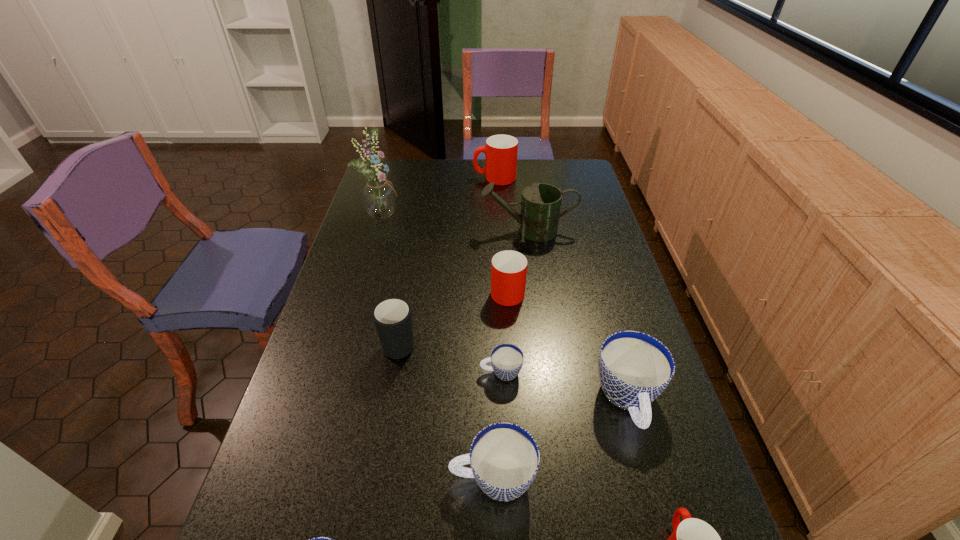
Identify the location of the tallest object. This screenshot has width=960, height=540. (379, 199).

Identify the location of bouquet. (379, 199).

The width and height of the screenshot is (960, 540). I want to click on green watering can, so click(540, 207).

Where is `the biggest red cup`? The width and height of the screenshot is (960, 540). the biggest red cup is located at coordinates (500, 151).

At what (x,y) coordinates should I click in order to perform the action: click on the tallest cup. Please return your answer as a coordinate pair (x, y). Image resolution: width=960 pixels, height=540 pixels. Looking at the image, I should click on (500, 151).

The width and height of the screenshot is (960, 540). Find the location of `mug`. mug is located at coordinates (392, 317).

The height and width of the screenshot is (540, 960). I want to click on the sixth nearest cup, so click(508, 268).

Identify the location of the second biggest red cup. The image size is (960, 540). (508, 268).

Locate an element on the screen. The image size is (960, 540). the rightmost blue cup is located at coordinates (635, 368).

At what (x,y) coordinates should I click in order to perform the action: click on the third nearest object. Please return your answer as a coordinate pair (x, y). The width and height of the screenshot is (960, 540). Looking at the image, I should click on (504, 457).